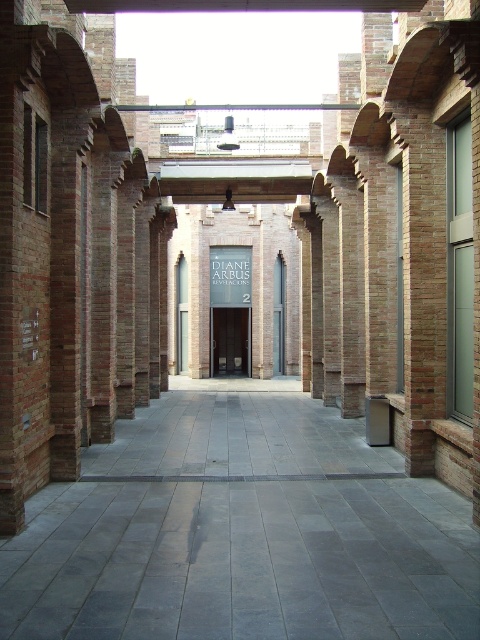
How distant is gray concrete path at center from black wooden door at center?

gray concrete path at center and black wooden door at center are 15.65 meters apart from each other.

Who is positioned more to the right, gray concrete path at center or black wooden door at center?

gray concrete path at center

Who is more distant from viewer, (122, 476) or (214, 332)?

Point (214, 332)

Identify the location of gray concrete path at center. (241, 531).